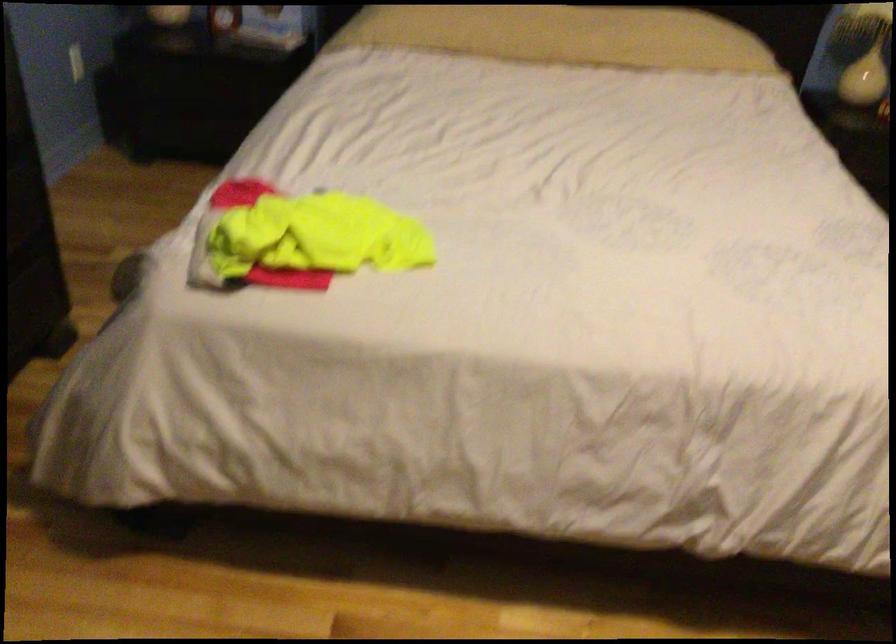
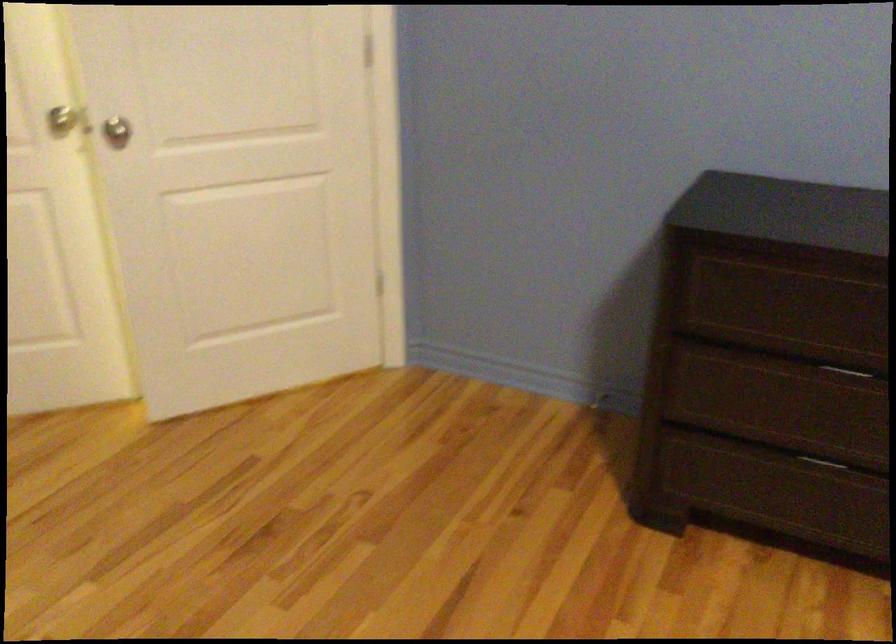
The first image is from the beginning of the video and the second image is from the end. How did the camera likely rotate when shooting the video?

The camera's rotation is toward left-down.